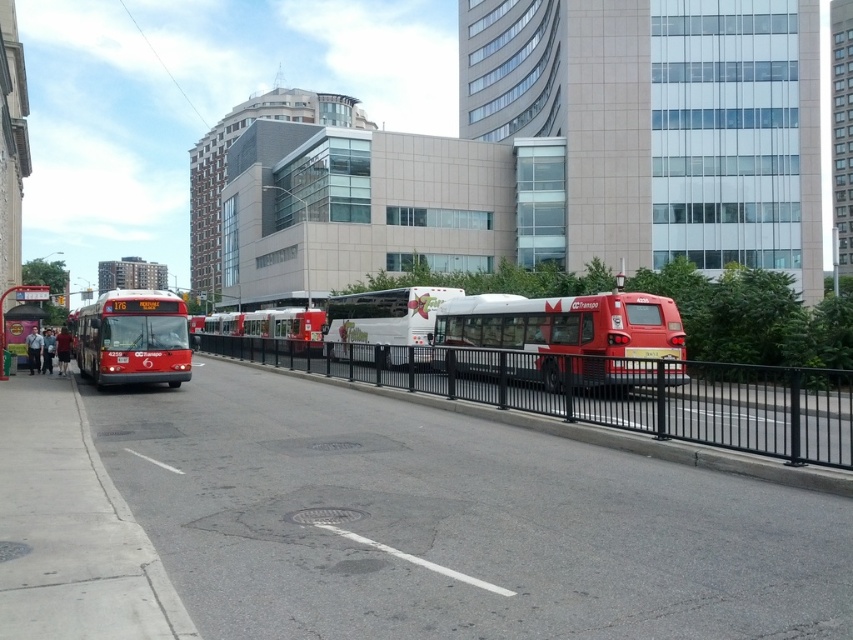
Question: Is matte red bus at center bigger than white painted line at lower center?

Choices:
 (A) no
 (B) yes

Answer: (B)

Question: Which object appears closest to the camera in this image?

Choices:
 (A) white matte bus at center
 (B) black metal fence at center
 (C) metallic bus stop at lower left
 (D) red matte bus at center

Answer: (B)

Question: Which of the following is the farthest from the observer?

Choices:
 (A) white matte bus at center
 (B) matte red bus at left
 (C) black metal fence at center

Answer: (B)

Question: Is red matte bus at center below metallic bus stop at lower left?

Choices:
 (A) no
 (B) yes

Answer: (B)

Question: Is matte red bus at left to the right of white asphalt line at center from the viewer's perspective?

Choices:
 (A) no
 (B) yes

Answer: (A)

Question: Among these points, which one is farthest from the camera?

Choices:
 (A) (386, 552)
 (B) (3, 369)

Answer: (B)